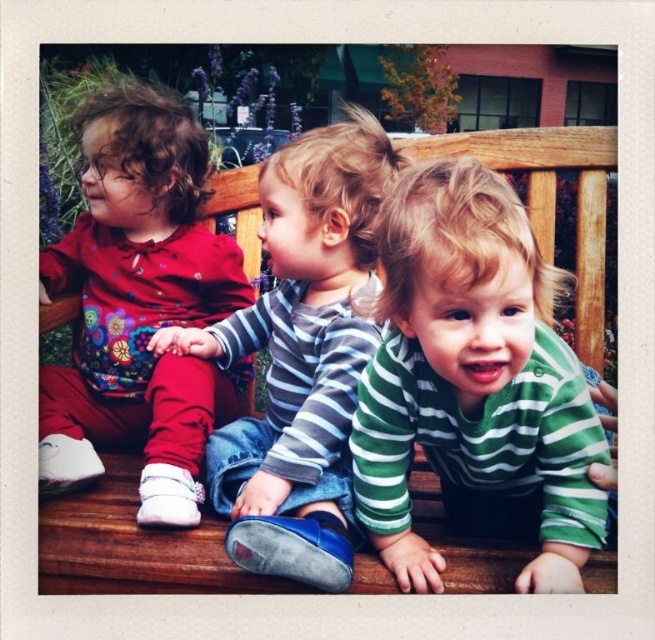
You are a photographer trying to capture a group shot of the children. You need to ensure that the green striped shirt at center and the striped cotton shirt at center are both visible in the frame. Based on their positions, which child should be placed to the right to ensure both shirts are visible?

The green striped shirt at center is positioned on the right side of the striped cotton shirt at center, so placing the child wearing the striped cotton shirt at center to the right would ensure both shirts are visible in the frame.

You are a photographer trying to capture a group photo of the children. You need to position yourself so that you can see both the green striped shirt at center and the matte floral shirt at left in your frame. Based on their positions, which direction should you stand relative to the children to ensure both are visible?

Since the green striped shirt at center is to the right of the matte floral shirt at left, you should stand to the left side of the children to ensure both are visible in your frame.